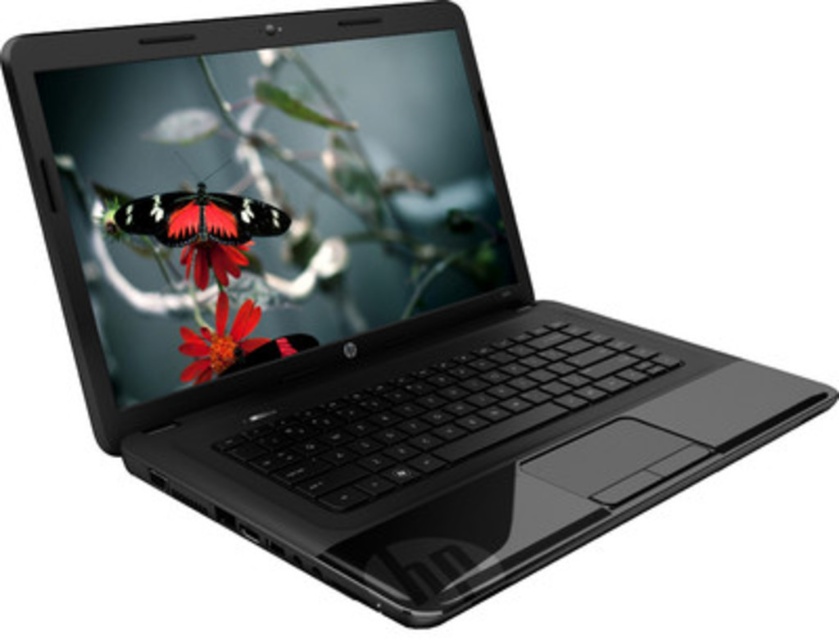
You are trying to determine the relative size of the glossy plastic screen at center and the red matte flower at center in the image. Based on the scene description, which object is taller?

The glossy plastic screen at center is much taller than the red matte flower at center.

You are a graphic designer working on a project and need to place a new element on the laptop screen. The laptop screen has a coordinate system where the bottom left corner is the origin point. Where should you place the new element so that it aligns with the existing matte black butterfly at center?

The matte black butterfly at center is positioned at point (201, 227), so you should place the new element at the same coordinates to align with it.